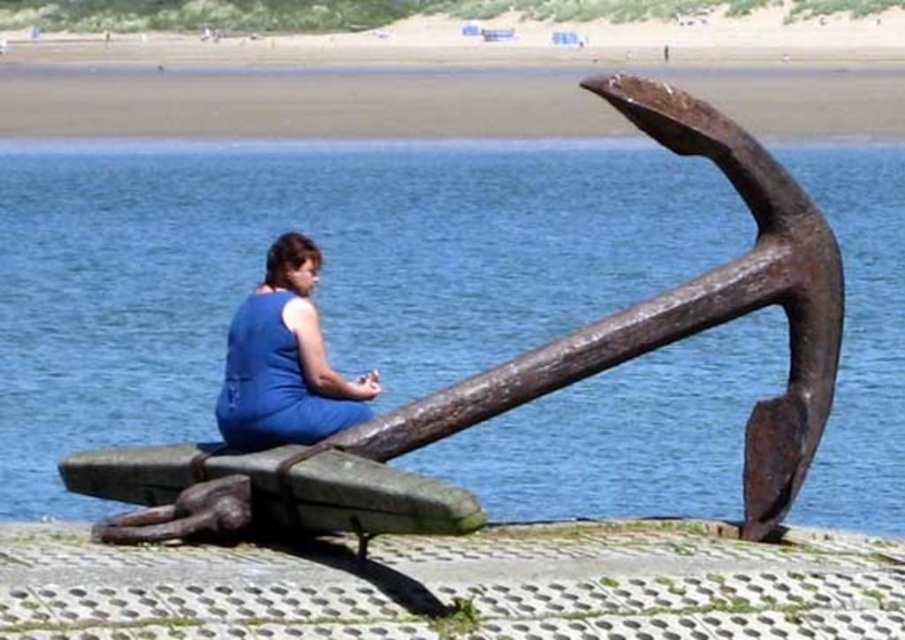
Question: Does rusty metal anchor at center appear under smooth sand at upper center?

Choices:
 (A) yes
 (B) no

Answer: (A)

Question: Does rusty metal anchor at center have a lesser width compared to blue fabric dress at center?

Choices:
 (A) no
 (B) yes

Answer: (A)

Question: Which object is positioned farthest from the blue fabric dress at center?

Choices:
 (A) rusty metal anchor at center
 (B) smooth sand at upper center

Answer: (B)

Question: Can you confirm if smooth sand at upper center is positioned to the left of blue fabric dress at center?

Choices:
 (A) yes
 (B) no

Answer: (A)

Question: Which point is closer to the camera taking this photo?

Choices:
 (A) (433, 93)
 (B) (307, 268)
 (C) (210, 298)

Answer: (B)

Question: Among these objects, which one is farthest from the camera?

Choices:
 (A) rusty metal anchor at center
 (B) blue fabric dress at center
 (C) smooth sand at upper center

Answer: (C)